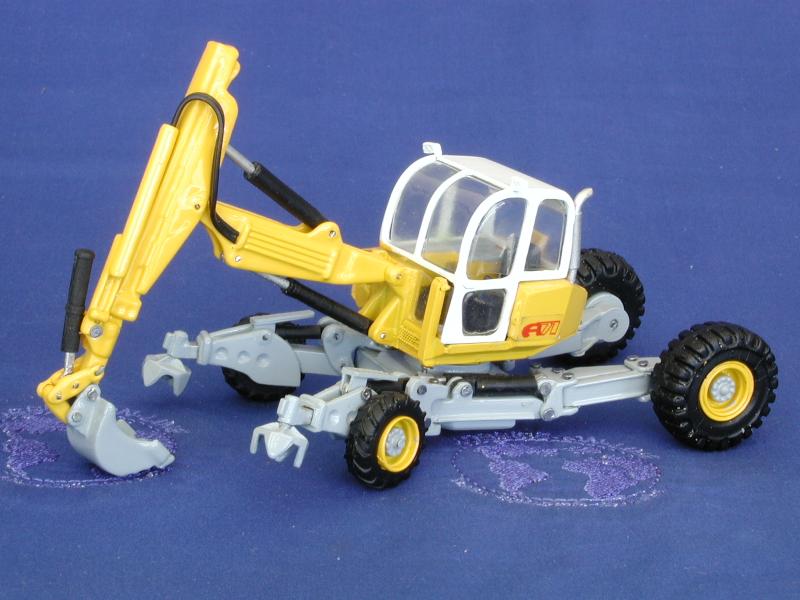
Locate an element on the screen. The height and width of the screenshot is (600, 800). excavator toy is located at coordinates (372, 264).